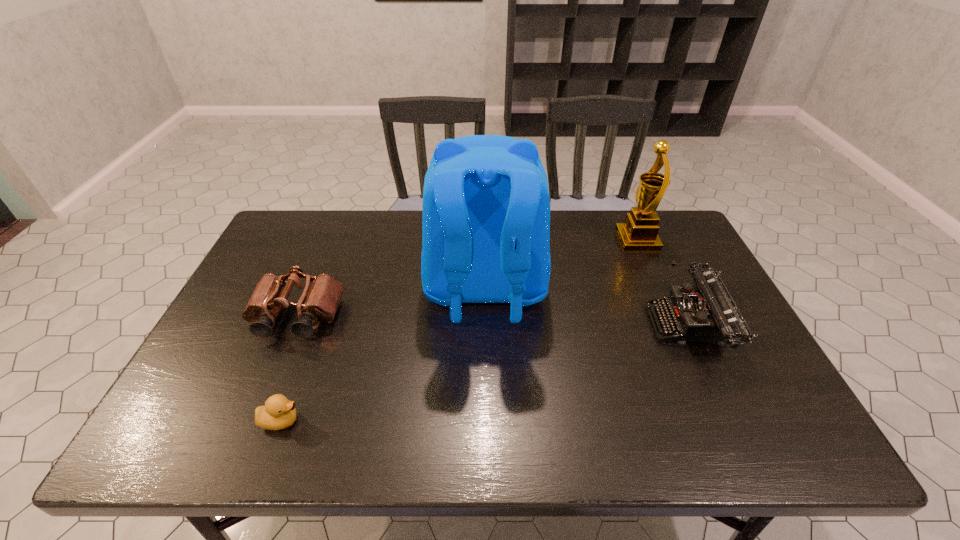
In order to click on award present at the right edge in this screenshot , I will do `click(639, 233)`.

This screenshot has width=960, height=540. In order to click on typewriter that is at the right edge in this screenshot , I will do `click(705, 312)`.

Find the location of `object situated at the far right corner`. object situated at the far right corner is located at coordinates (639, 233).

Identify the location of vacant space at the far edge of the desktop. This screenshot has height=540, width=960. 586,215.

Where is `vacant region at the left edge of the desktop`? The image size is (960, 540). vacant region at the left edge of the desktop is located at coordinates (211, 356).

Where is `free point at the right edge`? free point at the right edge is located at coordinates (766, 389).

In the image, there is a desktop. In order to click on vacant space at the far left corner in this screenshot , I will do `click(305, 251)`.

In the image, there is a desktop. Identify the location of free space at the far right corner. (660, 224).

In order to click on vacant area that lies between the nearest object and the second tallest object in this screenshot , I will do `click(459, 330)`.

Find the location of a particular element. The image size is (960, 540). free space between the shortest object and the typewriter is located at coordinates (485, 373).